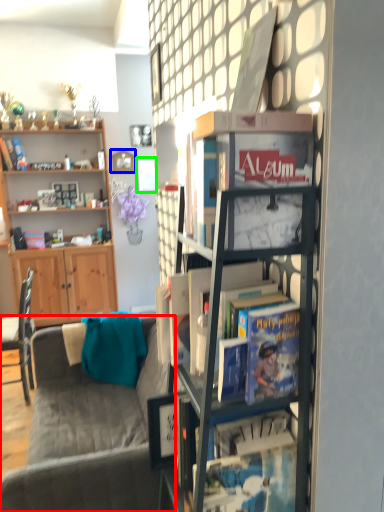
Question: Based on their relative distances, which object is nearer to studio couch (highlighted by a red box)? Choose from picture frame (highlighted by a blue box) and picture frame (highlighted by a green box).

Choices:
 (A) picture frame
 (B) picture frame

Answer: (B)